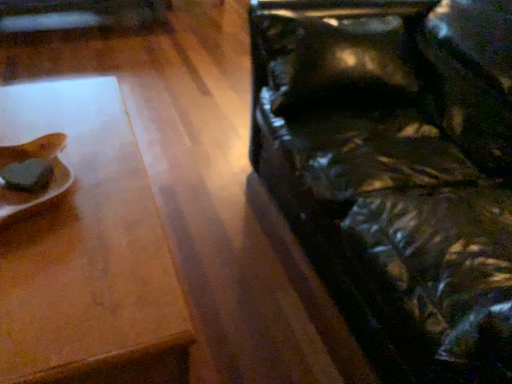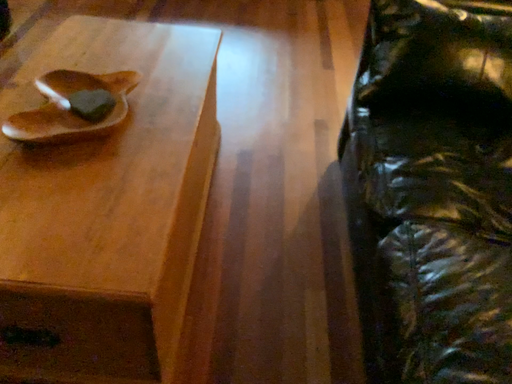
Question: Which way did the camera rotate in the video?

Choices:
 (A) rotated right
 (B) rotated left

Answer: (B)